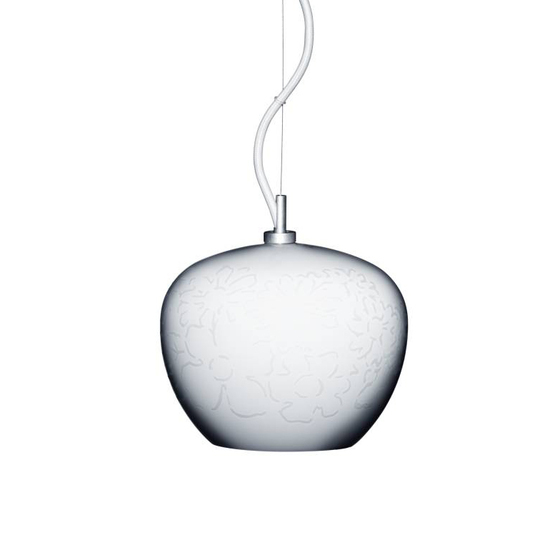
Image resolution: width=560 pixels, height=560 pixels. Identify the location of lampshade. (280, 415).